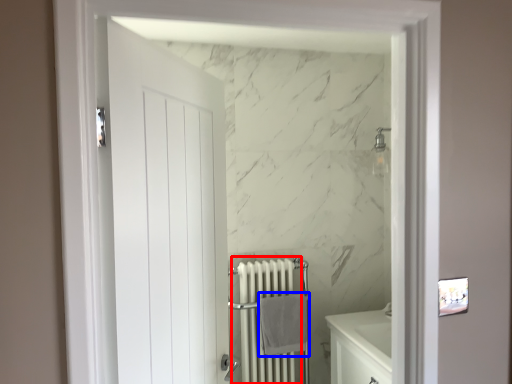
Question: Which point is further to the camera, radiator (highlighted by a red box) or bath towel (highlighted by a blue box)?

Choices:
 (A) radiator
 (B) bath towel

Answer: (B)